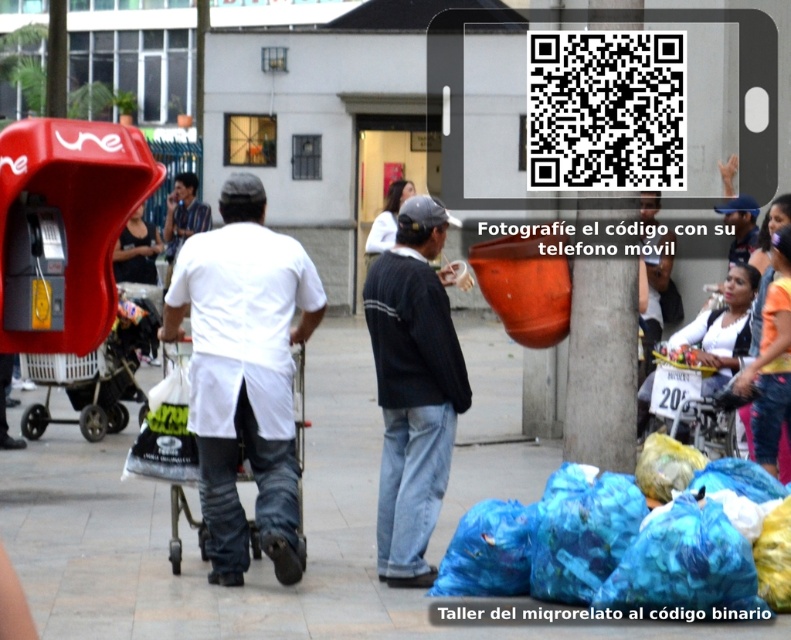
Question: Does dark blue jeans at lower right have a larger size compared to blue denim jacket at upper right?

Choices:
 (A) yes
 (B) no

Answer: (A)

Question: Which object is the farthest from the white matte shirt at center?

Choices:
 (A) dark blue jeans at lower right
 (B) blue denim jacket at upper right

Answer: (B)

Question: Considering the relative positions of blue plastic bags at lower center and blue denim jacket at upper right in the image provided, where is blue plastic bags at lower center located with respect to blue denim jacket at upper right?

Choices:
 (A) above
 (B) below

Answer: (B)

Question: Observing the image, what is the correct spatial positioning of blue plastic bags at lower center in reference to dark blue jeans at lower right?

Choices:
 (A) above
 (B) below

Answer: (B)

Question: Estimate the real-world distances between objects in this image. Which object is farther from the dark blue sweater at center?

Choices:
 (A) blue plastic bags at lower center
 (B) white matte shirt at center
 (C) dark blue jeans at lower right
 (D) blue denim jacket at upper right

Answer: (D)

Question: Which point is farther to the camera?

Choices:
 (A) blue denim jacket at upper right
 (B) white matte shirt at center
 (C) dark blue sweater at center

Answer: (A)